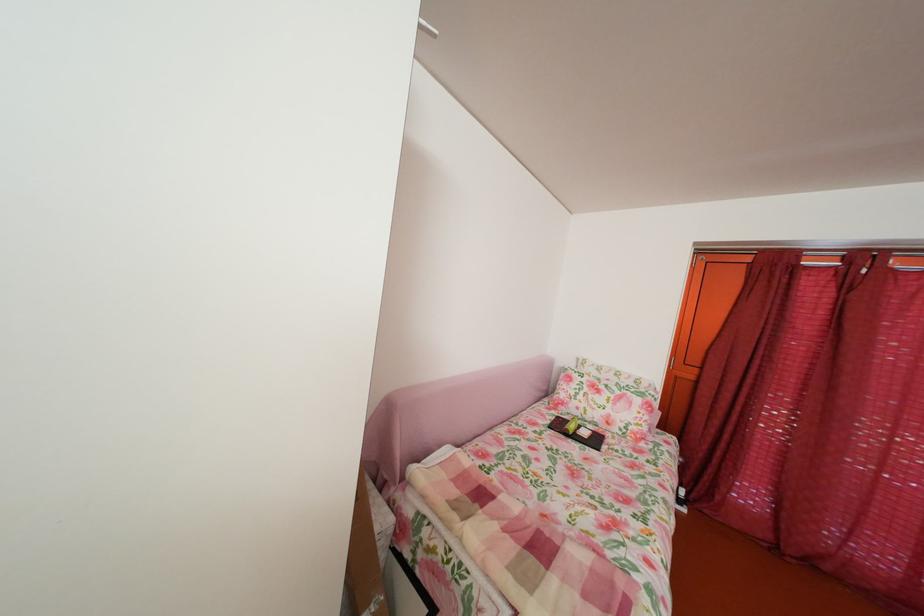
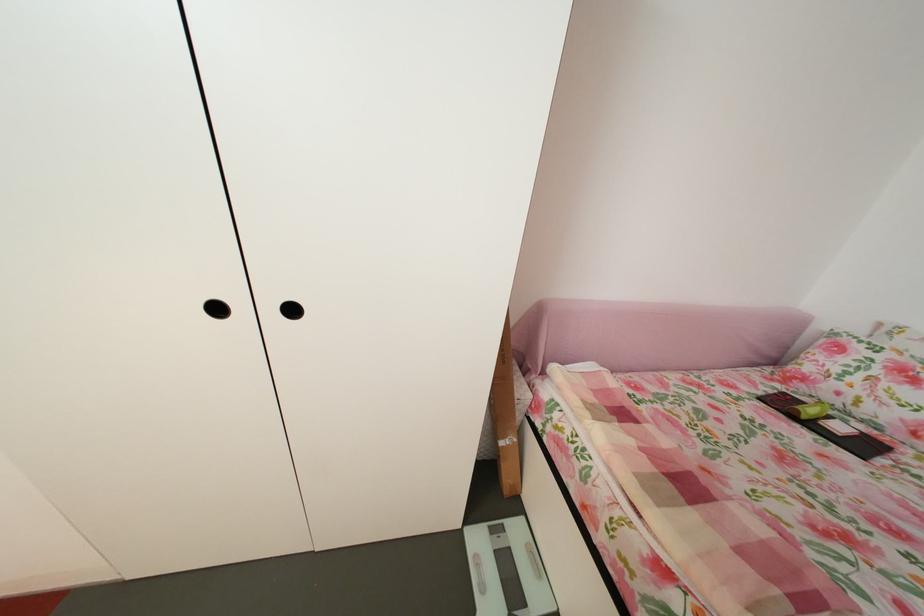
The point at (589,415) is marked in the first image. Where is the corresponding point in the second image?

(849, 400)